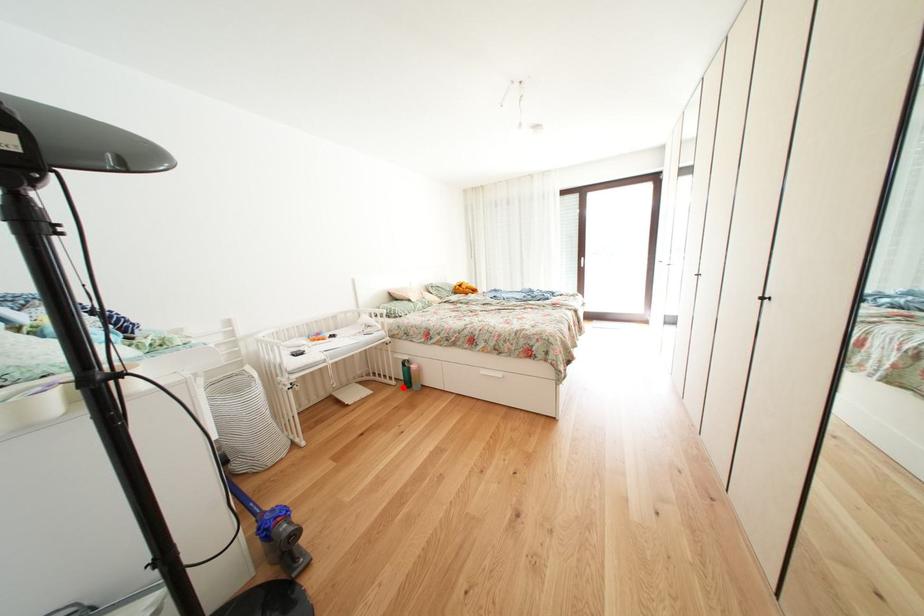
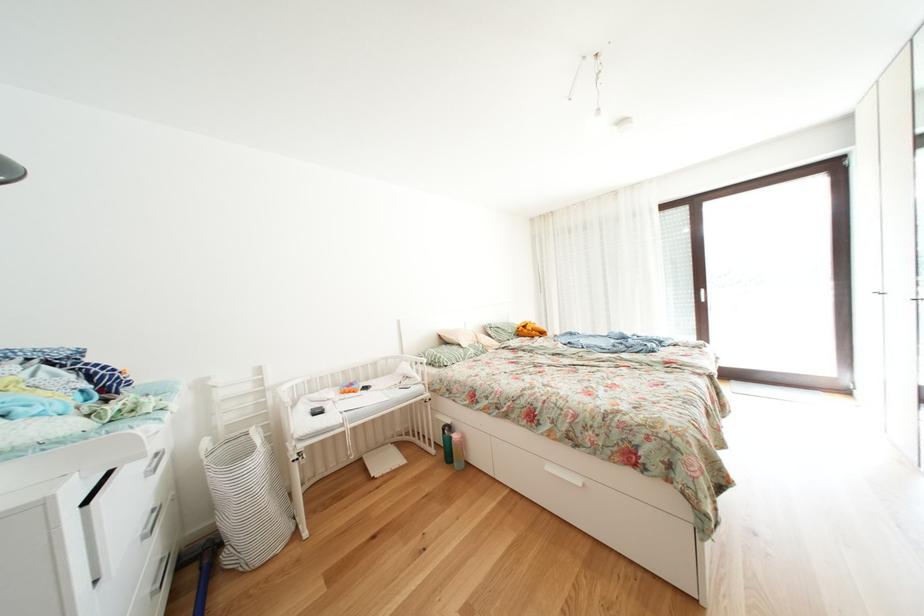
Locate, in the second image, the point that corresponds to the highlighted location in the first image.

(443, 456)